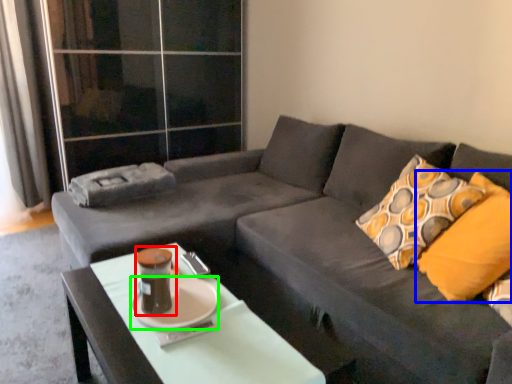
Question: Based on their relative distances, which object is nearer to teal (highlighted by a red box)? Choose from throw pillow (highlighted by a blue box) and saucer (highlighted by a green box).

Choices:
 (A) throw pillow
 (B) saucer

Answer: (B)